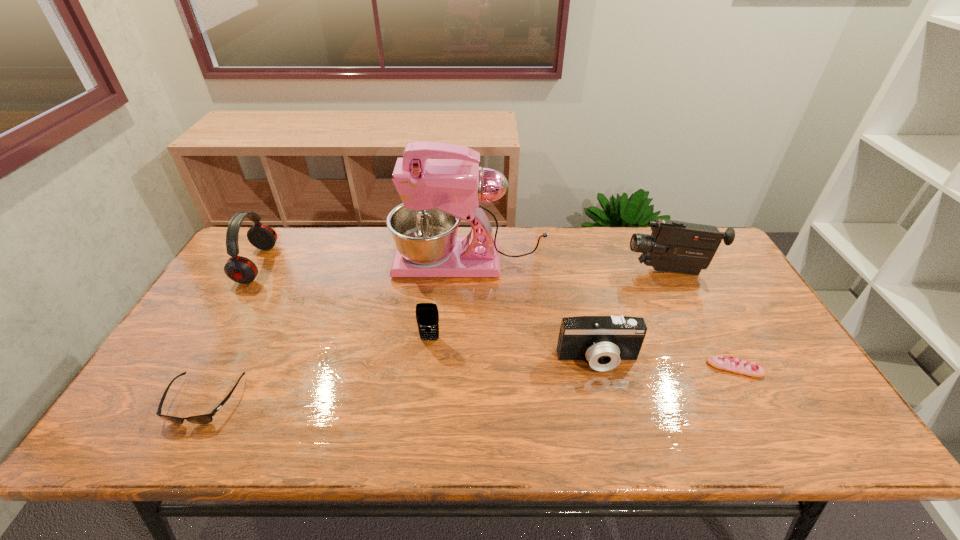
Where is `mixer`? This screenshot has height=540, width=960. mixer is located at coordinates (436, 193).

Find the location of a particular element. The width and height of the screenshot is (960, 540). the taller camcorder is located at coordinates (676, 246).

I want to click on the right camcorder, so click(676, 246).

I want to click on earphone, so 242,270.

Where is `the fourth nearest object`? The width and height of the screenshot is (960, 540). the fourth nearest object is located at coordinates (427, 316).

Identify the location of the nearer camcorder. This screenshot has height=540, width=960. (602, 340).

Find the location of a particular element. This screenshot has height=540, width=960. the shorter camcorder is located at coordinates (602, 340).

Find the location of `sunglasses`. sunglasses is located at coordinates point(206,418).

You are a GUI agent. You are given a task and a screenshot of the screen. Output one action in this format:
    pyautogui.click(x=<x>, y=<y>)
    Task: Click on the shortest object
    The height and width of the screenshot is (540, 960).
    Given the screenshot: What is the action you would take?
    pyautogui.click(x=738, y=366)

Identify the location of vacant space situated on the face of the tallest object. The image size is (960, 540). [x=375, y=262].